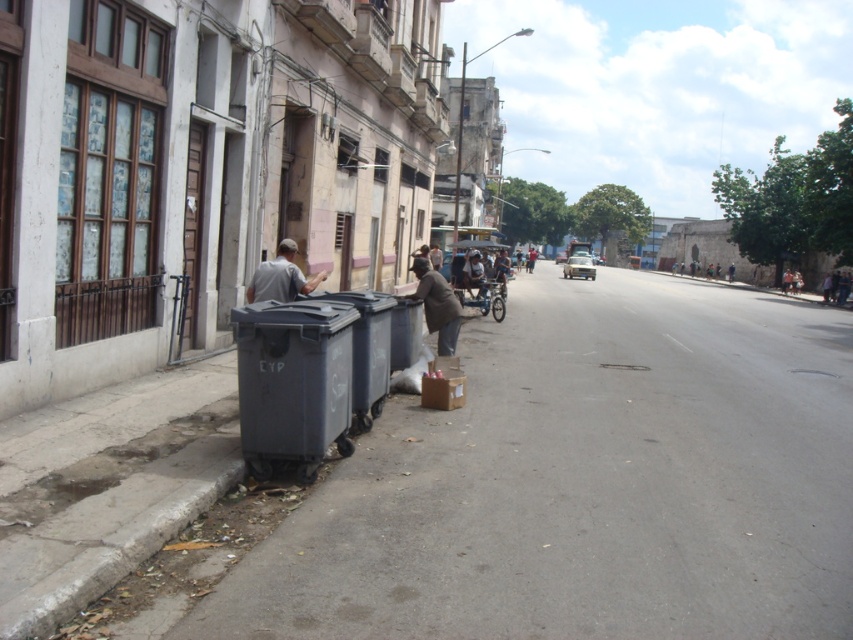
What do you see at coordinates (585, 483) in the screenshot?
I see `gray concrete pavement at lower left` at bounding box center [585, 483].

Is gray concrete pavement at lower left closer to the viewer compared to brown fabric bag at lower center?

Yes, gray concrete pavement at lower left is in front of brown fabric bag at lower center.

Is point (605, 596) closer to viewer compared to point (451, 307)?

Yes, it is in front of point (451, 307).

This screenshot has height=640, width=853. I want to click on gray concrete pavement at lower left, so click(585, 483).

From the picture: Does gray concrete pavement at lower left appear over metallic silver cart at center?

No, gray concrete pavement at lower left is not above metallic silver cart at center.

Between point (755, 531) and point (485, 259), which one is positioned behind?

Point (485, 259)

Is point (558, 522) closer to camera compared to point (463, 240)?

That is True.

You are a GUI agent. You are given a task and a screenshot of the screen. Output one action in this format:
    pyautogui.click(x=<x>, y=<y>)
    Task: Click on the gray concrete pavement at lower left
    
    Given the screenshot: What is the action you would take?
    pyautogui.click(x=585, y=483)

Which of these two, gray concrete curb at lower left or brown fabric bag at lower center, stands taller?

gray concrete curb at lower left

Can you confirm if gray concrete curb at lower left is shorter than brown fabric bag at lower center?

No.

Between point (73, 588) and point (434, 284), which one is positioned in front?

Point (73, 588) is in front.

The image size is (853, 640). I want to click on gray concrete curb at lower left, so click(109, 557).